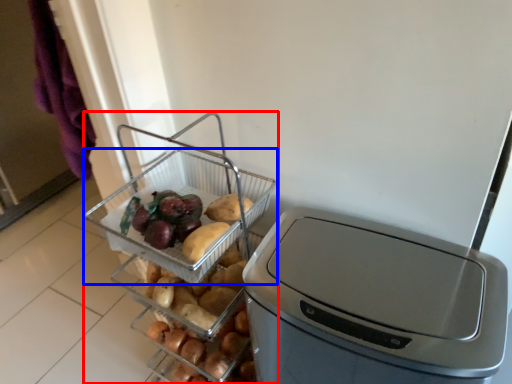
Question: Which object is closer to the camera taking this photo, appliance (highlighted by a red box) or basket (highlighted by a blue box)?

Choices:
 (A) appliance
 (B) basket

Answer: (A)